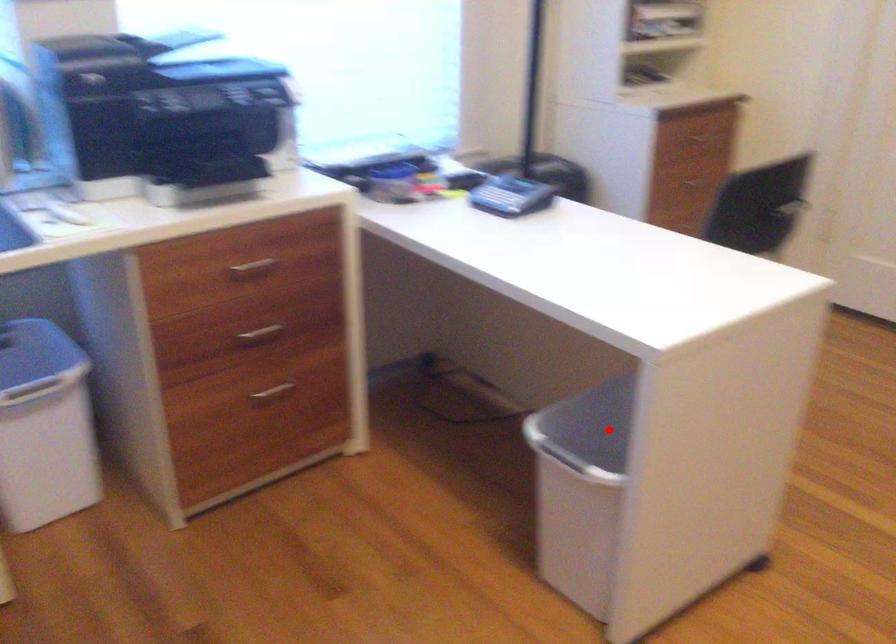
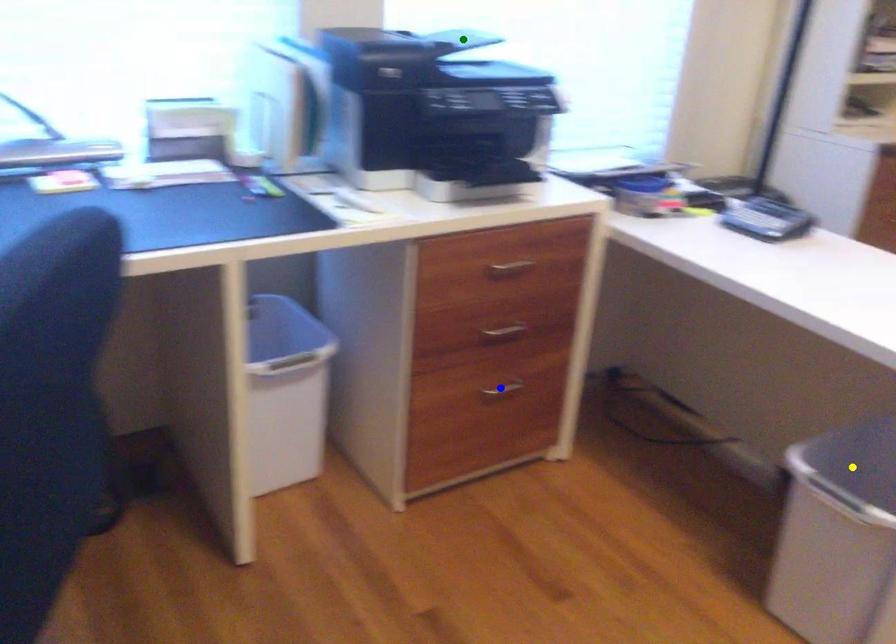
Question: I am providing you with two images of the same scene from different viewpoints. A red point is marked on the first image. You are given multiple points on the second image. Which point in image 2 represents the same 3d spot as the red point in image 1?

Choices:
 (A) green point
 (B) blue point
 (C) yellow point

Answer: (C)